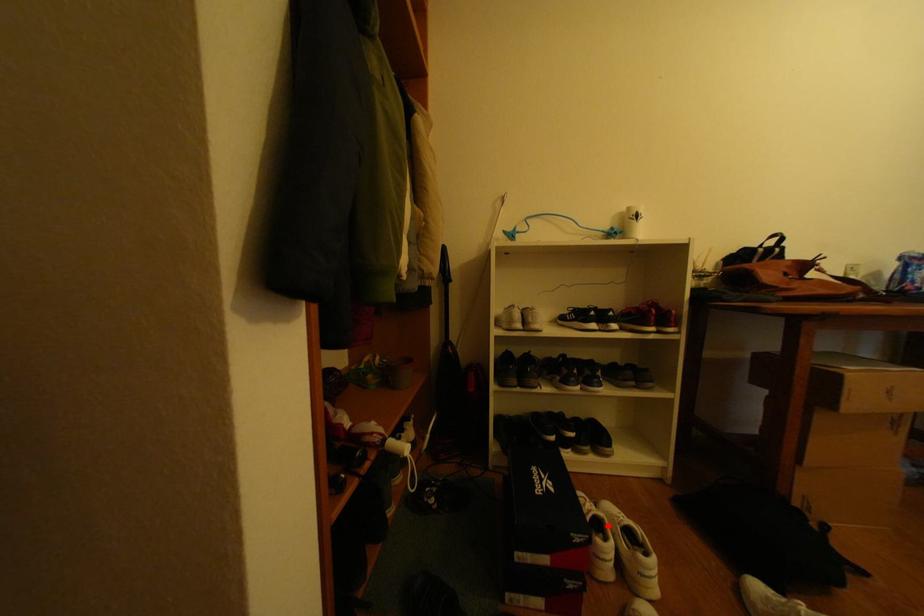
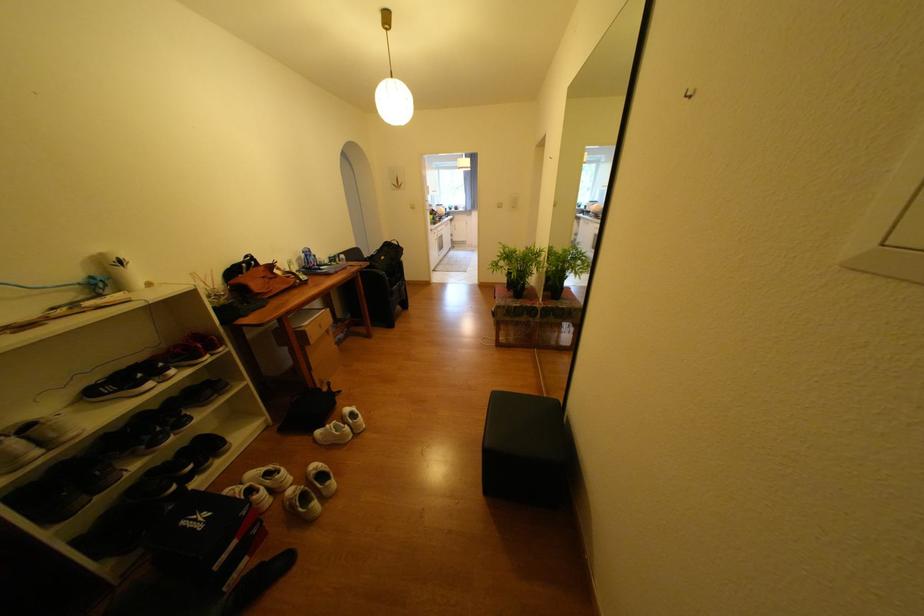
Find the pixel in the second image that matches the highlighted location in the first image.

(259, 492)